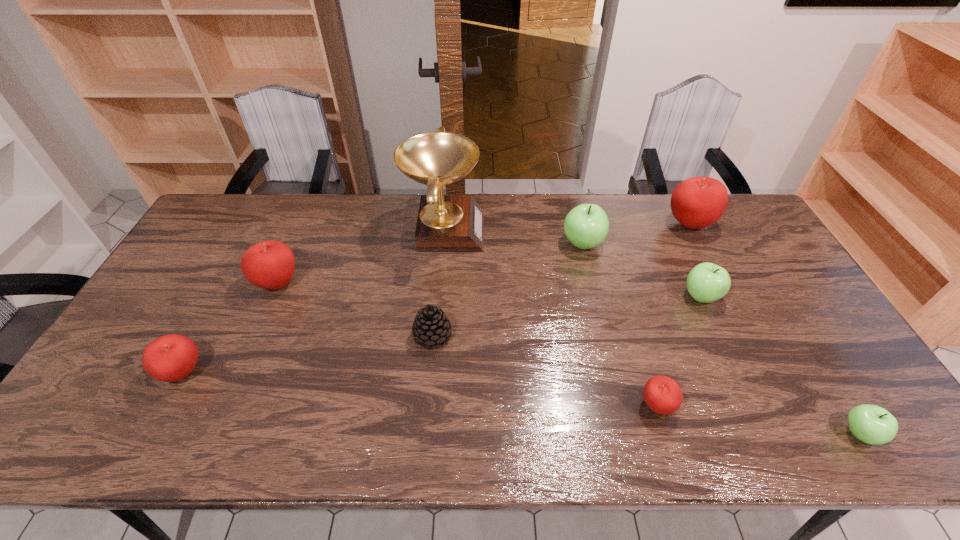
Find the location of a particular element. free space between the fourth nearest object and the smallest red apple is located at coordinates (544, 370).

Find the location of a particular element. free space between the leftmost red apple and the rightmost apple is located at coordinates point(521,403).

The width and height of the screenshot is (960, 540). Identify the location of free spot between the biggest red apple and the sixth farthest object. (561, 280).

The height and width of the screenshot is (540, 960). I want to click on object that is the sixth closest to the second smallest red apple, so click(x=707, y=282).

This screenshot has height=540, width=960. What are the coordinates of `the fourth closest object to the leftmost green apple` in the screenshot? It's located at (431, 327).

Point out which apple is positioned as the sixth nearest to the eighth shortest object. Please provide its 2D coordinates. Your answer should be formatted as a tuple, i.e. [(x, y)], where the tuple contains the x and y coordinates of a point satisfying the conditions above.

[(169, 358)]

This screenshot has width=960, height=540. What are the coordinates of `apple that can be found as the closest to the smallest red apple` in the screenshot? It's located at (707, 282).

Locate which red apple ranks second in proximity to the second green apple from left to right. Please provide its 2D coordinates. Your answer should be formatted as a tuple, i.e. [(x, y)], where the tuple contains the x and y coordinates of a point satisfying the conditions above.

[(662, 394)]

Select which red apple is the third closest to the second farthest red apple. Please provide its 2D coordinates. Your answer should be formatted as a tuple, i.e. [(x, y)], where the tuple contains the x and y coordinates of a point satisfying the conditions above.

[(697, 202)]

Identify which green apple is the third closest to the third red apple from left to right. Please provide its 2D coordinates. Your answer should be formatted as a tuple, i.e. [(x, y)], where the tuple contains the x and y coordinates of a point satisfying the conditions above.

[(586, 226)]